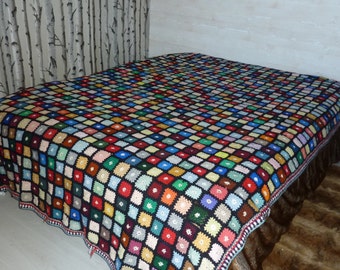
Identify the location of top of bed. [x=267, y=70].